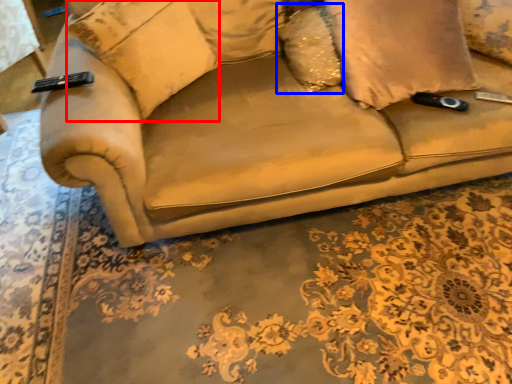
Question: Which object appears closest to the camera in this image, pillow (highlighted by a red box) or pillow (highlighted by a blue box)?

Choices:
 (A) pillow
 (B) pillow

Answer: (A)